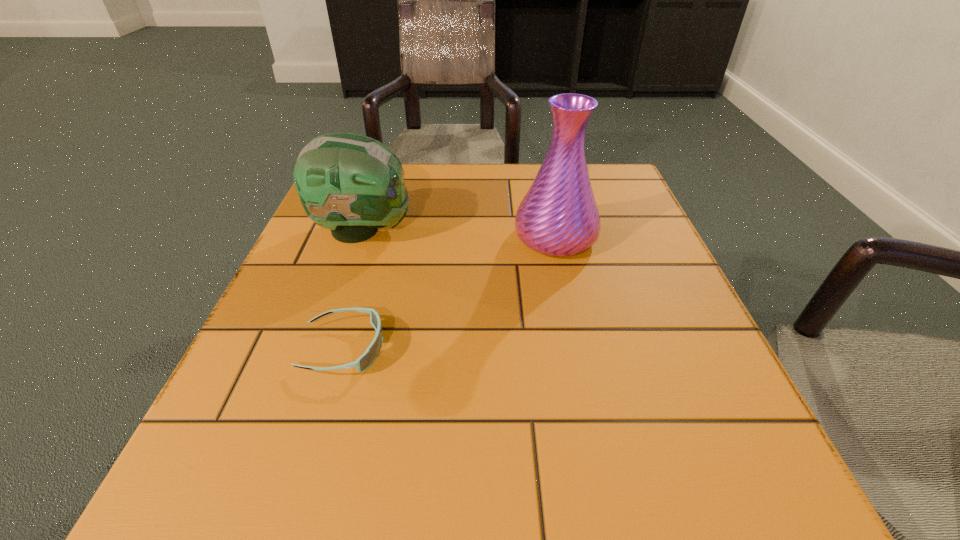
The height and width of the screenshot is (540, 960). I want to click on football helmet that is at the left edge, so click(352, 184).

Locate an element on the screen. goggles present at the left edge is located at coordinates (370, 355).

Locate an element on the screen. The image size is (960, 540). object that is at the right edge is located at coordinates (559, 216).

This screenshot has width=960, height=540. In order to click on object present at the far left corner in this screenshot , I will do `click(352, 184)`.

The image size is (960, 540). Find the location of `object positioned at the far right corner`. object positioned at the far right corner is located at coordinates (559, 216).

Locate an element on the screen. This screenshot has height=540, width=960. vacant area at the far edge is located at coordinates (470, 195).

In order to click on free location at the near edge in this screenshot , I will do `click(585, 522)`.

The width and height of the screenshot is (960, 540). I want to click on free spot at the left edge of the desktop, so click(324, 235).

Identify the location of free space at the right edge of the desktop. The height and width of the screenshot is (540, 960). (615, 237).

Locate an element on the screen. vacant space at the far right corner is located at coordinates (588, 166).